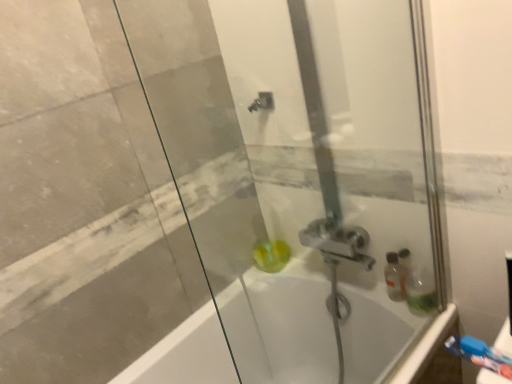
Question: Is translucent green soap at center spatially inside transparent glass shower door at center, or outside of it?

Choices:
 (A) outside
 (B) inside

Answer: (A)

Question: From the image's perspective, relative to transparent glass shower door at center, is translucent green soap at center above or below?

Choices:
 (A) below
 (B) above

Answer: (A)

Question: Which object is positioned closest to the blue plastic toothbrush at lower right?

Choices:
 (A) white glossy bathtub at center
 (B) transparent glass shower door at center
 (C) translucent green soap at center

Answer: (B)

Question: Based on their relative distances, which object is nearer to the blue plastic toothbrush at lower right?

Choices:
 (A) transparent glass shower door at center
 (B) translucent green soap at center
 (C) white glossy bathtub at center

Answer: (A)